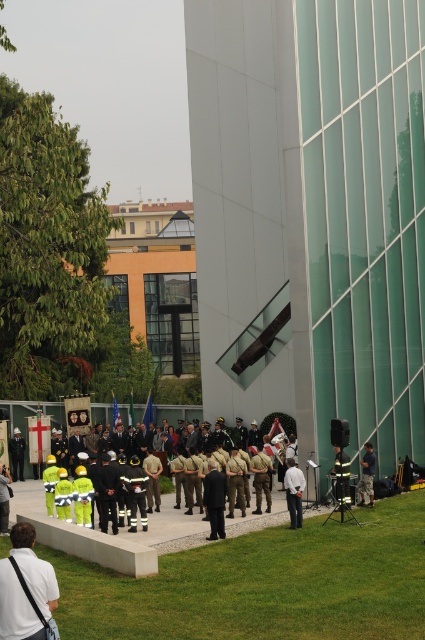
You are organizing a photo shoot and need to ensure that all elements in the scene are visible. Given the white fabric uniform at lower left and the reflective silver helmet at center, which object would be more challenging to photograph clearly due to its size?

The white fabric uniform at lower left is smaller than the reflective silver helmet at center, making it more challenging to photograph clearly due to its smaller size.

You are an attendee at this event and need to locate the reflective silver helmet at center. From your position at the white fabric uniform at lower left, in which direction should you look to find it?

The reflective silver helmet at center is located below the white fabric uniform at lower left, so you should look downward to find it.

Looking at this image, you are attending an outdoor event near a modern building. You see a white fabric uniform at lower left and a reflective silver helmet at center. Which object is positioned more to the left?

The white fabric uniform at lower left is positioned more to the left than the reflective silver helmet at center.